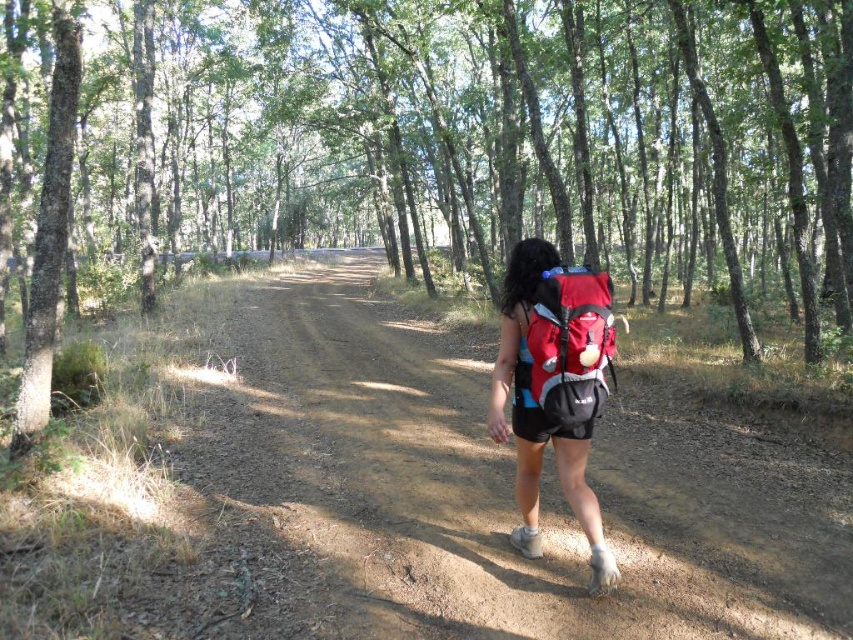
Between point (529, 371) and point (532, 314), which one is positioned behind?

The point (529, 371) is behind.

Can you confirm if matte red backpack at center is positioned below red matte backpack at center?

Yes, matte red backpack at center is below red matte backpack at center.

Is point (556, 448) less distant than point (532, 349)?

No, it is not.

At what (x,y) coordinates should I click in order to perform the action: click on matte red backpack at center. Please return your answer as a coordinate pair (x, y). This screenshot has width=853, height=640. Looking at the image, I should click on (554, 387).

Can you confirm if brown bark tree at center is taller than brown dirt track at center?

Yes.

From the picture: Can you confirm if brown bark tree at center is thinner than brown dirt track at center?

No, brown bark tree at center is not thinner than brown dirt track at center.

What do you see at coordinates (451, 136) in the screenshot? Image resolution: width=853 pixels, height=640 pixels. I see `brown bark tree at center` at bounding box center [451, 136].

This screenshot has width=853, height=640. Find the location of `brown bark tree at center`. brown bark tree at center is located at coordinates (451, 136).

Find the location of a particular element. This screenshot has height=640, width=853. brown bark tree at center is located at coordinates (451, 136).

Does brown bark tree at center appear on the left side of matte red backpack at center?

Yes, brown bark tree at center is to the left of matte red backpack at center.

This screenshot has height=640, width=853. Find the location of `brown bark tree at center`. brown bark tree at center is located at coordinates (451, 136).